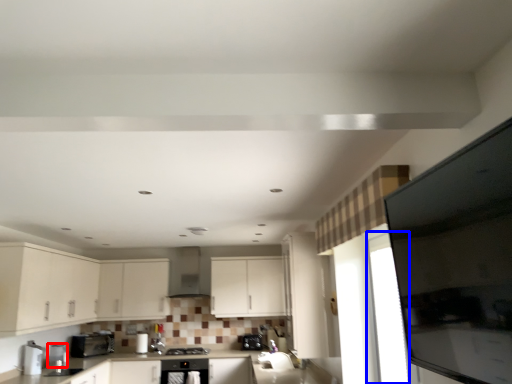
Question: Which object is closer to the camera taking this photo, appliance (highlighted by a red box) or glass door (highlighted by a blue box)?

Choices:
 (A) appliance
 (B) glass door

Answer: (B)